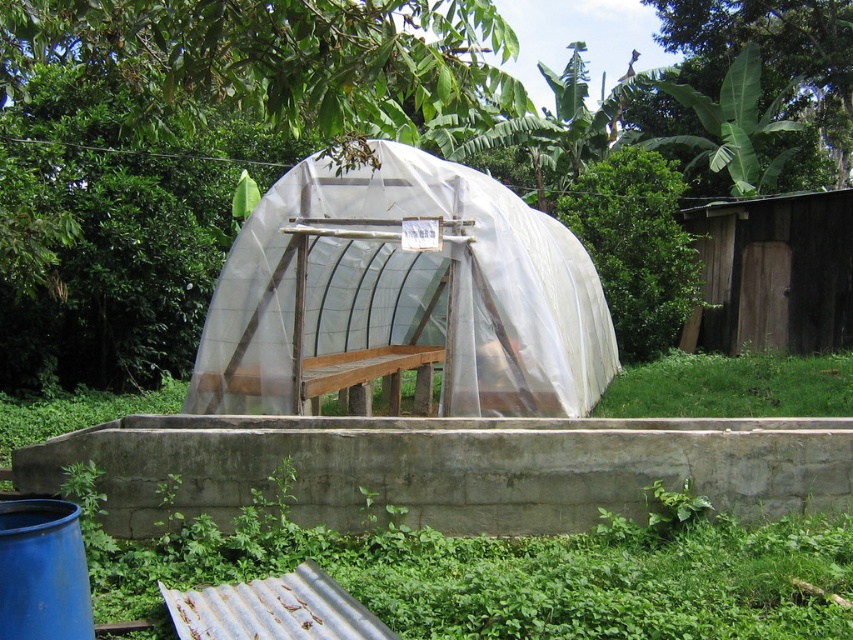
You are standing in front of the greenhouse and want to determine the relative positions of two points marked on the structure. Which point, point (x=387, y=236) or point (x=834, y=205), is closer to you?

Point (x=387, y=236) is closer to the viewer than point (x=834, y=205).

You are a gardener standing on the raised concrete platform in front of the transparent plastic hut at center. You want to reach the top of the green leafy plant at lower left. Can you do so without climbing onto the hut?

The transparent plastic hut at center has a lesser height compared to green leafy plant at lower left, so you can reach the top of the green leafy plant at lower left without needing to climb onto the hut since the plant is taller than the hut.